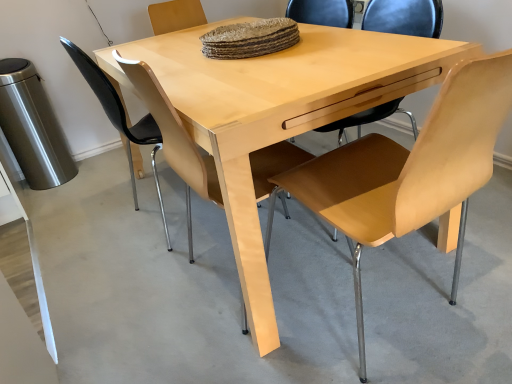
Question: From the image's perspective, is light wood table at center located above or below light brown wood chair at center, the third chair when ordered from left to right?

Choices:
 (A) below
 (B) above

Answer: (B)

Question: Considering the relative positions of light wood table at center and light brown wood chair at center, which is counted as the 1th chair, starting from the right, in the image provided, is light wood table at center to the left or to the right of light brown wood chair at center, which is counted as the 1th chair, starting from the right,?

Choices:
 (A) right
 (B) left

Answer: (B)

Question: Which of these objects is positioned closest to the light wood chair at center, the second chair in the left-to-right sequence?

Choices:
 (A) light brown wood chair at center, the third chair when ordered from left to right
 (B) brown woven mat at center
 (C) light wood table at center
 (D) light brown leather chair at center, the 3th chair viewed from the right

Answer: (A)

Question: Which is nearer to the light brown wood chair at center, the third chair when ordered from left to right?

Choices:
 (A) light wood table at center
 (B) brown woven mat at center
 (C) light wood chair at center, the second chair in the left-to-right sequence
 (D) light brown leather chair at center, which is the 1th chair in left-to-right order

Answer: (C)